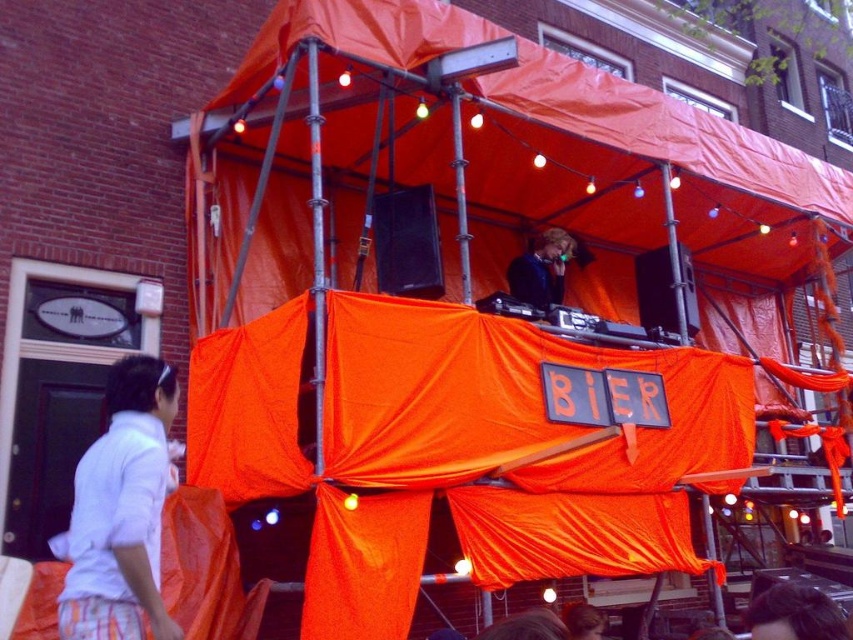
Question: Does white cotton shirt at lower left appear under blonde hair at lower center?

Choices:
 (A) no
 (B) yes

Answer: (A)

Question: Which point is closer to the camera taking this photo?

Choices:
 (A) (115, 456)
 (B) (517, 262)

Answer: (A)

Question: Is blonde hair at upper center to the left of blonde hair dj at center from the viewer's perspective?

Choices:
 (A) no
 (B) yes

Answer: (A)

Question: Which point is farther to the camera?

Choices:
 (A) white cotton shirt at lower left
 (B) blonde hair at upper center
 (C) blonde hair at lower center
 (D) blonde hair dj at center

Answer: (D)

Question: Estimate the real-world distances between objects in this image. Which object is closer to the blonde hair at lower center?

Choices:
 (A) blonde hair dj at center
 (B) white cotton shirt at lower left
 (C) blonde hair at upper center

Answer: (C)

Question: Does white cotton shirt at lower left have a larger size compared to blonde hair at upper center?

Choices:
 (A) no
 (B) yes

Answer: (B)